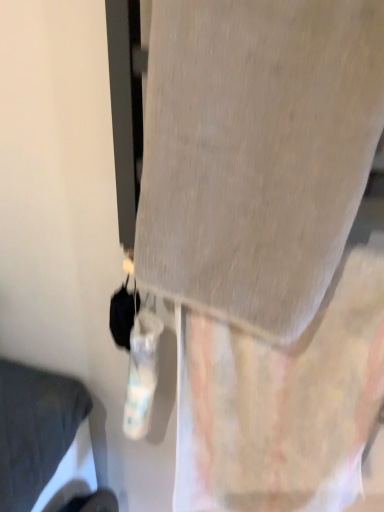
This screenshot has width=384, height=512. Describe the element at coordinates (34, 428) in the screenshot. I see `matte gray pillow at lower left` at that location.

The width and height of the screenshot is (384, 512). Describe the element at coordinates (282, 403) in the screenshot. I see `textured beige curtain at center` at that location.

Where is `matte gray pillow at lower left`? matte gray pillow at lower left is located at coordinates (34, 428).

What's the angular difference between matte gray pillow at lower left and textured beige curtain at center's facing directions?

The angle between the facing direction of matte gray pillow at lower left and the facing direction of textured beige curtain at center is 90.5 degrees.

From a real-world perspective, is matte gray pillow at lower left physically located above or below textured beige curtain at center?

From a real-world perspective, matte gray pillow at lower left is physically below textured beige curtain at center.

Consider the image. Does matte gray pillow at lower left lie behind textured beige curtain at center?

Yes, it is.

Is matte gray pillow at lower left facing away from textured beige curtain at center?

No.

Does gray fabric at center have a larger size compared to matte gray pillow at lower left?

No, gray fabric at center is not bigger than matte gray pillow at lower left.

Is gray fabric at center positioned in front of matte gray pillow at lower left?

Yes, it is.

Which is more to the right, gray fabric at center or matte gray pillow at lower left?

From the viewer's perspective, gray fabric at center appears more on the right side.

Which is less distant, (x=224, y=194) or (x=21, y=460)?

Point (x=224, y=194) appears to be closer to the viewer than point (x=21, y=460).

Which object is wider, gray fabric at center or textured beige curtain at center?

With larger width is gray fabric at center.

Is textured beige curtain at center at the back of gray fabric at center?

gray fabric at center does not have its back to textured beige curtain at center.

From a real-world perspective, is gray fabric at center below textured beige curtain at center?

Incorrect, from a real-world perspective, gray fabric at center is higher than textured beige curtain at center.

Considering the positions of objects gray fabric at center and textured beige curtain at center in the image provided, who is behind, gray fabric at center or textured beige curtain at center?

textured beige curtain at center is further away from the camera.

Measure the distance from textured beige curtain at center to gray fabric at center.

The distance of textured beige curtain at center from gray fabric at center is 8.97 inches.

Is point (241, 375) behind point (254, 113)?

Yes, point (241, 375) is behind point (254, 113).

From the image's perspective, is textured beige curtain at center over gray fabric at center?

Incorrect, from the image's perspective, textured beige curtain at center is lower than gray fabric at center.

Looking at their sizes, would you say textured beige curtain at center is wider or thinner than gray fabric at center?

textured beige curtain at center is thinner than gray fabric at center.

Measure the distance between textured beige curtain at center and matte gray pillow at lower left.

textured beige curtain at center and matte gray pillow at lower left are 15.37 inches apart from each other.

Are textured beige curtain at center and matte gray pillow at lower left beside each other?

No, textured beige curtain at center is not in contact with matte gray pillow at lower left.

Is textured beige curtain at center positioned with its back to matte gray pillow at lower left?

That's not correct — textured beige curtain at center is not looking away from matte gray pillow at lower left.

Which object is thinner, textured beige curtain at center or matte gray pillow at lower left?

With smaller width is textured beige curtain at center.

How different are the orientations of matte gray pillow at lower left and gray fabric at center in degrees?

The angle between the facing direction of matte gray pillow at lower left and the facing direction of gray fabric at center is 90.5 degrees.

Is matte gray pillow at lower left oriented away from gray fabric at center?

No, gray fabric at center is not at the back of matte gray pillow at lower left.

Would you say matte gray pillow at lower left is a long distance from gray fabric at center?

matte gray pillow at lower left is near gray fabric at center, not far away.

Considering the positions of objects matte gray pillow at lower left and gray fabric at center in the image provided, who is behind, matte gray pillow at lower left or gray fabric at center?

matte gray pillow at lower left is behind.

At what (x,y) coordinates should I click in order to perform the action: click on furniture below the textured beige curtain at center (from a real-world perspective). Please return your answer as a coordinate pair (x, y). The height and width of the screenshot is (512, 384). Looking at the image, I should click on click(x=34, y=428).

The image size is (384, 512). Identify the location of fabric above the matte gray pillow at lower left (from a real-world perspective). (256, 153).

When comparing their distances from gray fabric at center, does textured beige curtain at center or matte gray pillow at lower left seem further?

The object further to gray fabric at center is matte gray pillow at lower left.

Estimate the real-world distances between objects in this image. Which object is further from gray fabric at center, matte gray pillow at lower left or textured beige curtain at center?

The object further to gray fabric at center is matte gray pillow at lower left.

Based on their spatial positions, is matte gray pillow at lower left or gray fabric at center further from textured beige curtain at center?

The object further to textured beige curtain at center is matte gray pillow at lower left.

Based on their spatial positions, is gray fabric at center or matte gray pillow at lower left closer to textured beige curtain at center?

Based on the image, gray fabric at center appears to be nearer to textured beige curtain at center.

Estimate the real-world distances between objects in this image. Which object is further from matte gray pillow at lower left, gray fabric at center or textured beige curtain at center?

gray fabric at center.

Considering their positions, is textured beige curtain at center positioned further to matte gray pillow at lower left than gray fabric at center?

The object further to matte gray pillow at lower left is gray fabric at center.

Find the location of a particular element. The width and height of the screenshot is (384, 512). curtain between gray fabric at center and matte gray pillow at lower left vertically is located at coordinates (282, 403).